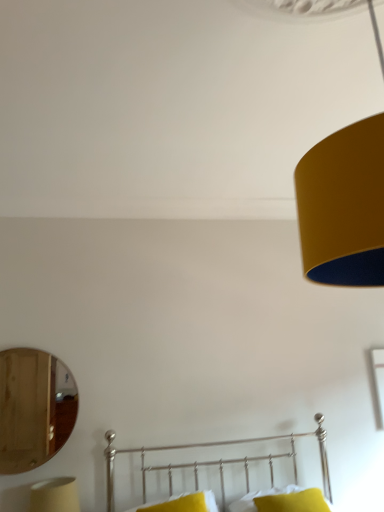
Question: Is matte yellow lampshade at lower left positioned behind metallic silver bed at lower center?

Choices:
 (A) no
 (B) yes

Answer: (B)

Question: Does matte yellow lampshade at lower left have a smaller size compared to metallic silver bed at lower center?

Choices:
 (A) no
 (B) yes

Answer: (B)

Question: Could you tell me if matte yellow lampshade at lower left is turned towards metallic silver bed at lower center?

Choices:
 (A) yes
 (B) no

Answer: (B)

Question: Does matte yellow lampshade at lower left contain metallic silver bed at lower center?

Choices:
 (A) yes
 (B) no

Answer: (B)

Question: From the image's perspective, would you say matte yellow lampshade at lower left is positioned over metallic silver bed at lower center?

Choices:
 (A) no
 (B) yes

Answer: (A)

Question: Is matte yellow lampshade at lower left wider than metallic silver bed at lower center?

Choices:
 (A) yes
 (B) no

Answer: (B)

Question: From a real-world perspective, is matte yellow lampshade at lower left located higher than wooden mirror at left?

Choices:
 (A) no
 (B) yes

Answer: (A)

Question: From the image's perspective, is matte yellow lampshade at lower left on wooden mirror at left?

Choices:
 (A) no
 (B) yes

Answer: (A)

Question: Can you confirm if matte yellow lampshade at lower left is smaller than wooden mirror at left?

Choices:
 (A) yes
 (B) no

Answer: (A)

Question: Does matte yellow lampshade at lower left have a larger size compared to wooden mirror at left?

Choices:
 (A) yes
 (B) no

Answer: (B)

Question: From the image's perspective, is matte yellow lampshade at lower left under wooden mirror at left?

Choices:
 (A) no
 (B) yes

Answer: (B)

Question: Could you tell me if matte yellow lampshade at lower left is turned towards wooden mirror at left?

Choices:
 (A) no
 (B) yes

Answer: (A)

Question: Is yellow fabric pillow at lower center, which appears as the first pillow when viewed from the left, taller than matte yellow lampshade at lower left?

Choices:
 (A) yes
 (B) no

Answer: (B)